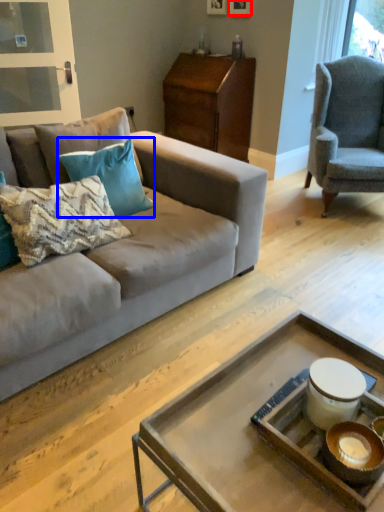
Question: Which point is closer to the camera, picture frame (highlighted by a red box) or pillow (highlighted by a blue box)?

Choices:
 (A) picture frame
 (B) pillow

Answer: (B)